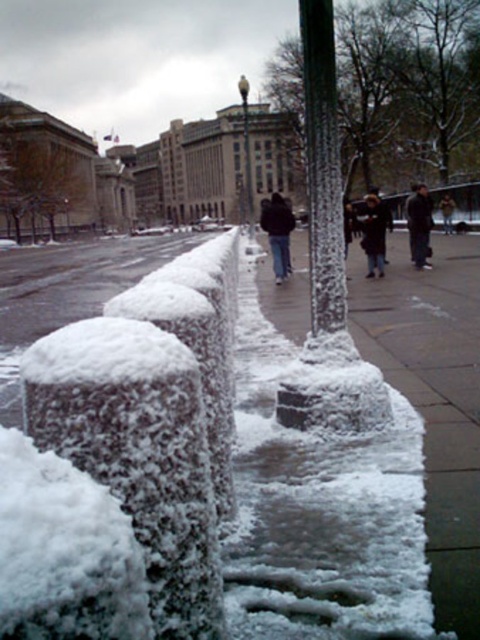
Is dark blue jacket at center behind dark gray jacket at center?

No, it is not.

This screenshot has width=480, height=640. What do you see at coordinates (373, 234) in the screenshot?
I see `dark blue jacket at center` at bounding box center [373, 234].

Does point (383, 205) come farther from viewer compared to point (440, 204)?

No, it is in front of (440, 204).

Find the location of a particular element. Image resolution: width=480 pixels, height=640 pixels. dark blue jacket at center is located at coordinates (373, 234).

Image resolution: width=480 pixels, height=640 pixels. What do you see at coordinates (277, 234) in the screenshot?
I see `dark blue jeans at center` at bounding box center [277, 234].

Is point (275, 221) in front of point (363, 237)?

No, it is not.

The image size is (480, 640). In order to click on dark blue jeans at center in this screenshot , I will do `click(277, 234)`.

From the picture: Does white frosted pole at center have a lesser width compared to dark gray jacket at center?

Yes.

Locate an element on the screen. Image resolution: width=480 pixels, height=640 pixels. white frosted pole at center is located at coordinates [323, 168].